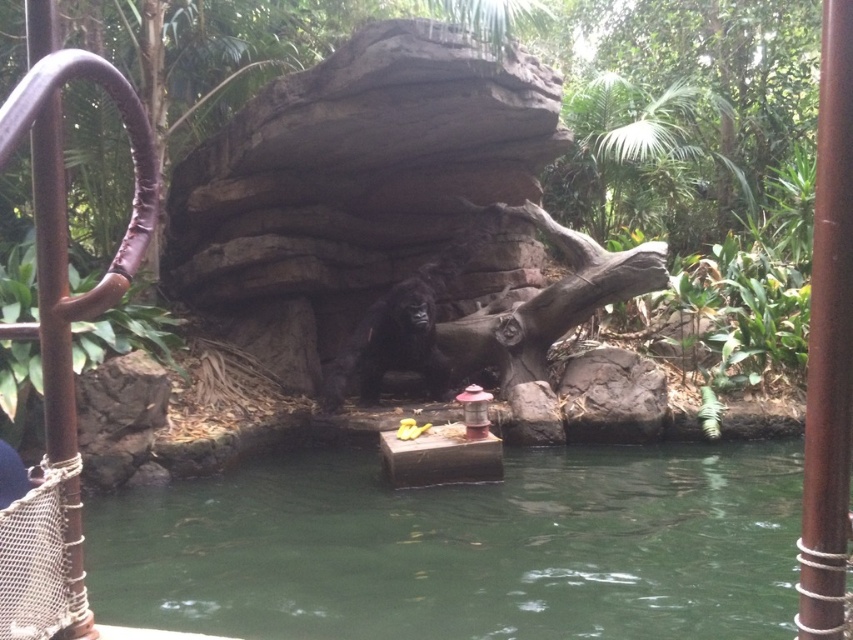
Question: Is brown leather rail at left positioned before dark brown fur gorilla at center?

Choices:
 (A) no
 (B) yes

Answer: (B)

Question: Is green water at center bigger than dark brown fur gorilla at center?

Choices:
 (A) yes
 (B) no

Answer: (A)

Question: Can you confirm if brown leather rail at left is bigger than dark brown fur gorilla at center?

Choices:
 (A) no
 (B) yes

Answer: (A)

Question: Which point is farther to the camera?

Choices:
 (A) tap(54, 51)
 (B) tap(315, 618)
 (C) tap(402, 285)

Answer: (C)

Question: Which of these objects is positioned closest to the dark brown fur gorilla at center?

Choices:
 (A) brown leather rail at left
 (B) green water at center

Answer: (B)

Question: Estimate the real-world distances between objects in this image. Which object is farther from the brown leather rail at left?

Choices:
 (A) green water at center
 (B) dark brown fur gorilla at center

Answer: (B)